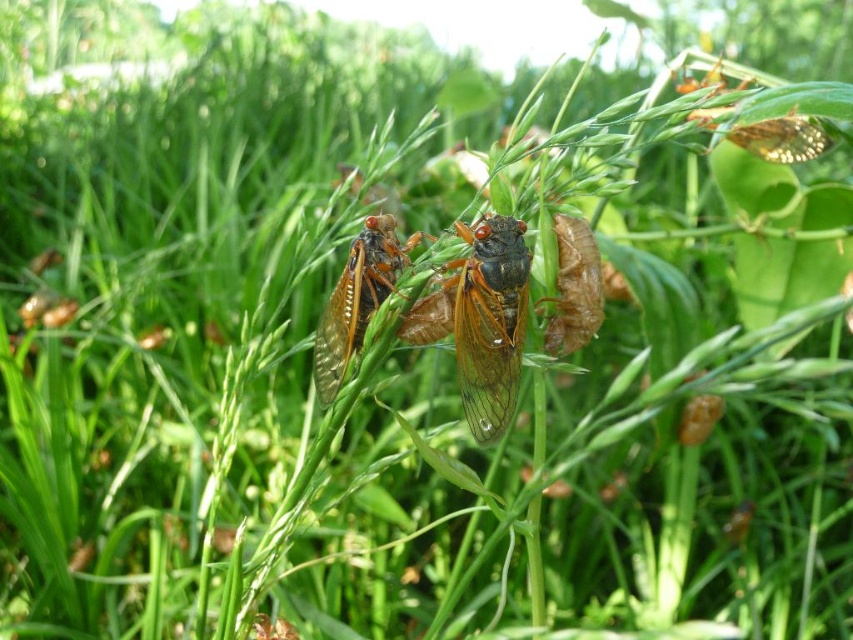
Based on the photo, you are an entomologist observing two insects in a grassy field. You notice the translucent amber wings at center and the translucent brown cicada at center. Which of these two insects is positioned closer to your viewpoint?

The translucent amber wings at center is closer to the viewer than the translucent brown cicada at center.

You are an entomologist observing the cicadas in the image. You notice two objects labeled as translucent amber wings at center and translucent brown cicada at center. Which of these two objects is located below the other?

The translucent amber wings at center is positioned under the translucent brown cicada at center.